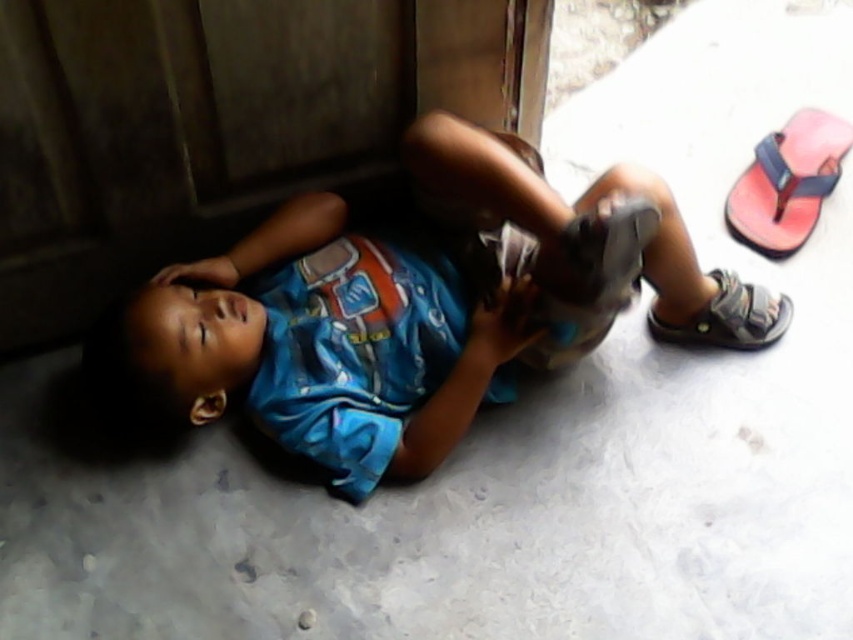
Question: Where is blue printed shirt at lower center located in relation to gray fabric sandal at lower right in the image?

Choices:
 (A) left
 (B) right

Answer: (A)

Question: Can you confirm if blue printed shirt at lower center is positioned to the right of matte gray shoe at lower center?

Choices:
 (A) yes
 (B) no

Answer: (B)

Question: Which object is the farthest from the pink rubber sandal at upper right?

Choices:
 (A) matte gray shoe at lower center
 (B) blue printed shirt at lower center
 (C) gray fabric sandal at lower right

Answer: (B)

Question: Can you confirm if pink rubber sandal at upper right is positioned to the left of gray fabric sandal at lower right?

Choices:
 (A) no
 (B) yes

Answer: (A)

Question: Which of the following is the closest to the observer?

Choices:
 (A) gray fabric sandal at lower right
 (B) blue printed shirt at lower center
 (C) pink rubber sandal at upper right

Answer: (B)

Question: Which point appears farthest from the camera in this image?

Choices:
 (A) (825, 179)
 (B) (326, 256)
 (C) (715, 269)

Answer: (A)